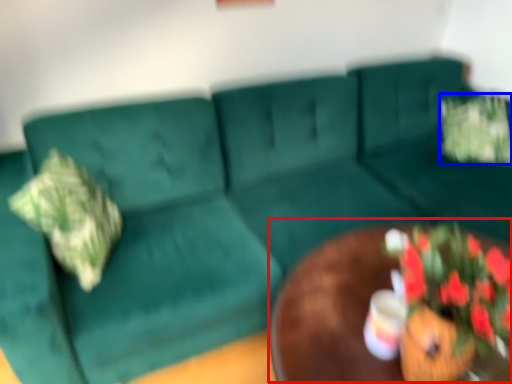
Question: Which of the following is the closest to the observer, round table (highlighted by a red box) or flower (highlighted by a blue box)?

Choices:
 (A) round table
 (B) flower

Answer: (A)